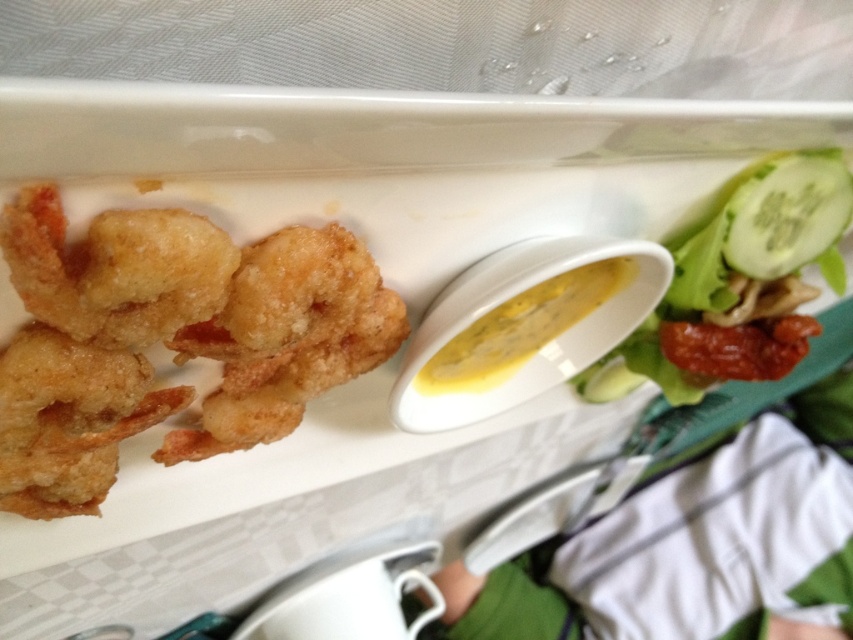
Based on the photo, which is more to the left, golden crispy shrimp at upper left or green leafy salad at upper right?

Positioned to the left is golden crispy shrimp at upper left.

Who is higher up, golden crispy shrimp at upper left or green leafy salad at upper right?

green leafy salad at upper right is above.

Is point (252, 296) closer to viewer compared to point (712, 291)?

Yes.

Locate an element on the screen. golden crispy shrimp at upper left is located at coordinates (169, 339).